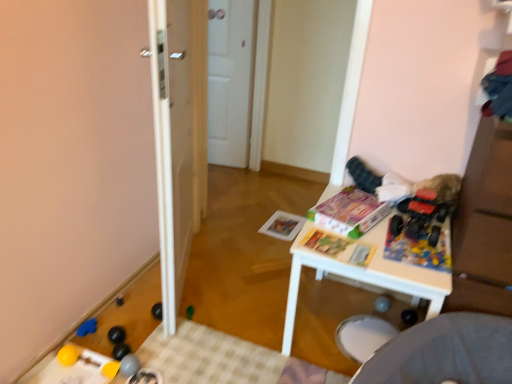
You are a GUI agent. You are given a task and a screenshot of the screen. Output one action in this format:
    pyautogui.click(x=<x>, y=<y>)
    Task: Click on the free space on the front side of rubberized plastic toy at center right, which appears as the first toy when viewed from the top
    The image size is (512, 384).
    Given the screenshot: What is the action you would take?
    pyautogui.click(x=424, y=256)